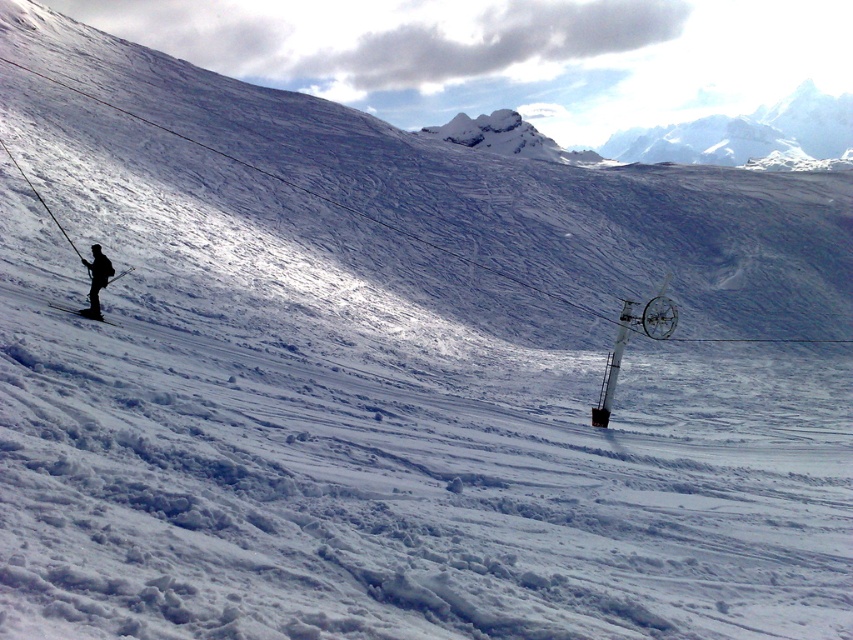
You are a photographer standing at the edge of the ski slope. You want to capture a photo of two specific points marked in the scene. The first point is at coordinates point (107, 272) and the second is at point (62, 305). Based on the scene description, which point is closer to your camera position?

Point (107, 272) is further to the camera than point (62, 305), so the second point is closer to the camera.

You are planning to take a photo of the black matte skier at left and the black matte ski at lower left. Which object should you zoom in on to capture more details of its shape?

The black matte skier at left has a lesser width compared to the black matte ski at lower left, so you should zoom in on the black matte skier at left to capture more details of its shape.